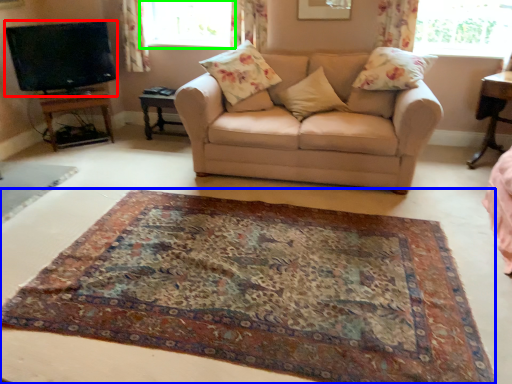
Question: Which object is the farthest from television (highlighted by a red box)? Choose among these: mat (highlighted by a blue box) or window (highlighted by a green box).

Choices:
 (A) mat
 (B) window

Answer: (A)